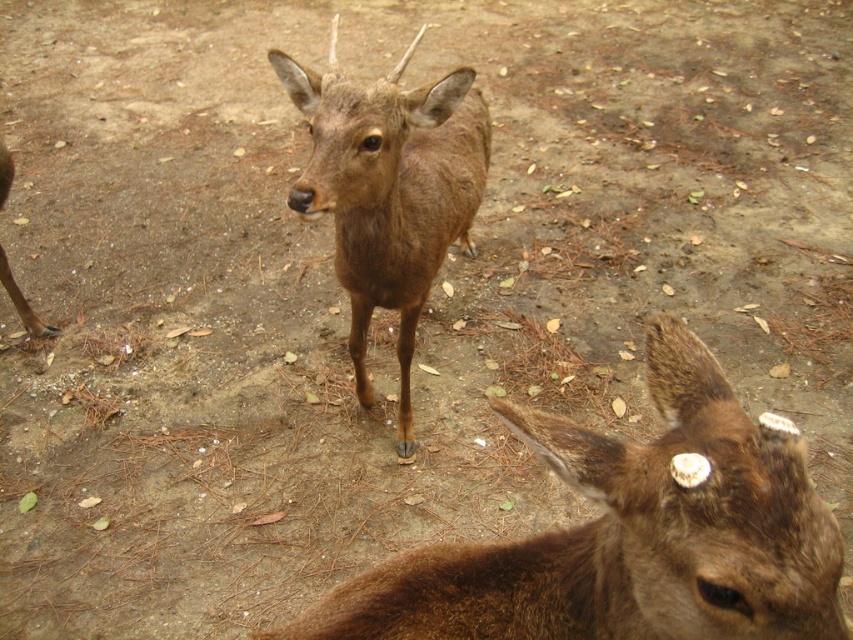
Question: Among these objects, which one is farthest from the camera?

Choices:
 (A) brown furry deer at center
 (B) brown matte/deer at center

Answer: (B)

Question: Is brown furry deer at center in front of brown matte/deer at center?

Choices:
 (A) no
 (B) yes

Answer: (B)

Question: Is brown furry deer at center to the left of brown matte/deer at center from the viewer's perspective?

Choices:
 (A) no
 (B) yes

Answer: (A)

Question: Is brown furry deer at center positioned at the back of brown matte/deer at center?

Choices:
 (A) no
 (B) yes

Answer: (A)

Question: Which of the following is the closest to the observer?

Choices:
 (A) brown furry deer at center
 (B) brown matte/deer at center

Answer: (A)

Question: Which point is farther to the camera?

Choices:
 (A) brown matte/deer at center
 (B) brown furry deer at center

Answer: (A)